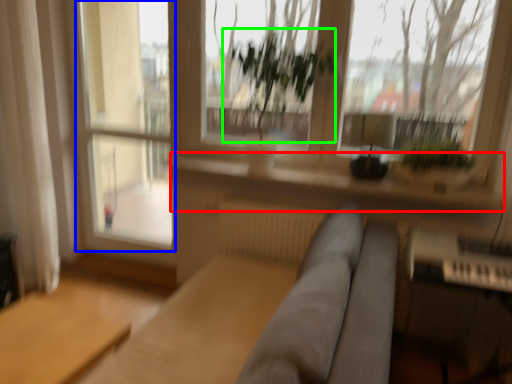
Question: Which object is positioned closest to window sill (highlighted by a red box)? Select from screen door (highlighted by a blue box) and vegetation (highlighted by a green box).

Choices:
 (A) screen door
 (B) vegetation

Answer: (A)